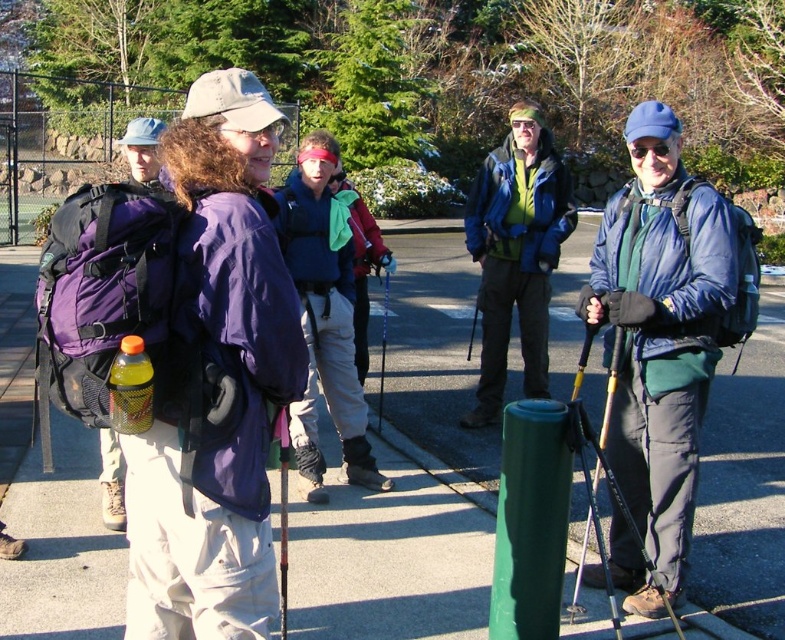
Which is below, blue matte jacket at center or matte black ski pole at center?

blue matte jacket at center is lower down.

Consider the image. Who is more forward, (623, 576) or (386, 280)?

Point (623, 576) is in front.

Is point (628, 321) more distant than point (380, 406)?

No, (628, 321) is closer to viewer.

You are a GUI agent. You are given a task and a screenshot of the screen. Output one action in this format:
    pyautogui.click(x=<x>, y=<y>)
    Task: Click on the blue matte jacket at center
    The image size is (785, 640).
    Given the screenshot: What is the action you would take?
    pyautogui.click(x=659, y=330)

Who is more distant from viewer, (x=776, y=552) or (x=257, y=184)?

The point (x=776, y=552) is more distant.

Between gray asphalt pavement at center and purple fabric backpack at center, which one has more height?

With more height is gray asphalt pavement at center.

Between point (754, 362) and point (234, 456), which one is positioned in front?

Point (234, 456) is in front.

Where is `gray asphalt pavement at center`? The height and width of the screenshot is (640, 785). gray asphalt pavement at center is located at coordinates (743, 484).

Is point (319, 513) positioned behind point (287, 413)?

That is True.

Is gray asphalt pavement at center in front of green plastic ski pole at center?

No, gray asphalt pavement at center is behind green plastic ski pole at center.

Is point (769, 554) positioned in front of point (276, 420)?

No, it is not.

Find the location of `gray asphalt pavement at center`. gray asphalt pavement at center is located at coordinates (743, 484).